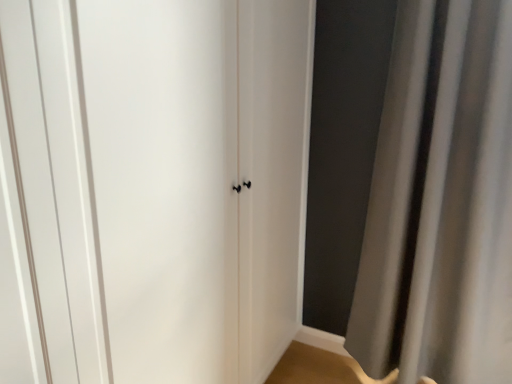
Question: Does gray fabric curtain at right have a smaller size compared to white matte door at center?

Choices:
 (A) no
 (B) yes

Answer: (A)

Question: Is gray fabric curtain at right facing towards white matte door at center?

Choices:
 (A) yes
 (B) no

Answer: (B)

Question: From the image's perspective, does gray fabric curtain at right appear lower than white matte door at center?

Choices:
 (A) yes
 (B) no

Answer: (B)

Question: From the image's perspective, is gray fabric curtain at right on top of white matte door at center?

Choices:
 (A) no
 (B) yes

Answer: (B)

Question: Considering the relative sizes of gray fabric curtain at right and white matte door at center in the image provided, is gray fabric curtain at right shorter than white matte door at center?

Choices:
 (A) no
 (B) yes

Answer: (B)

Question: Is gray fabric curtain at right outside white matte door at center?

Choices:
 (A) no
 (B) yes

Answer: (B)

Question: Is gray fabric curtain at right inside white matte door at center?

Choices:
 (A) yes
 (B) no

Answer: (B)

Question: Is white matte door at center looking in the opposite direction of gray fabric curtain at right?

Choices:
 (A) no
 (B) yes

Answer: (A)

Question: From the image's perspective, would you say white matte door at center is positioned over gray fabric curtain at right?

Choices:
 (A) no
 (B) yes

Answer: (A)

Question: From the image's perspective, is white matte door at center located beneath gray fabric curtain at right?

Choices:
 (A) no
 (B) yes

Answer: (B)

Question: Does white matte door at center appear on the right side of gray fabric curtain at right?

Choices:
 (A) no
 (B) yes

Answer: (A)

Question: Is white matte door at center behind gray fabric curtain at right?

Choices:
 (A) no
 (B) yes

Answer: (A)

Question: Considering their positions, is white matte door at center located in front of or behind gray fabric curtain at right?

Choices:
 (A) front
 (B) behind

Answer: (A)